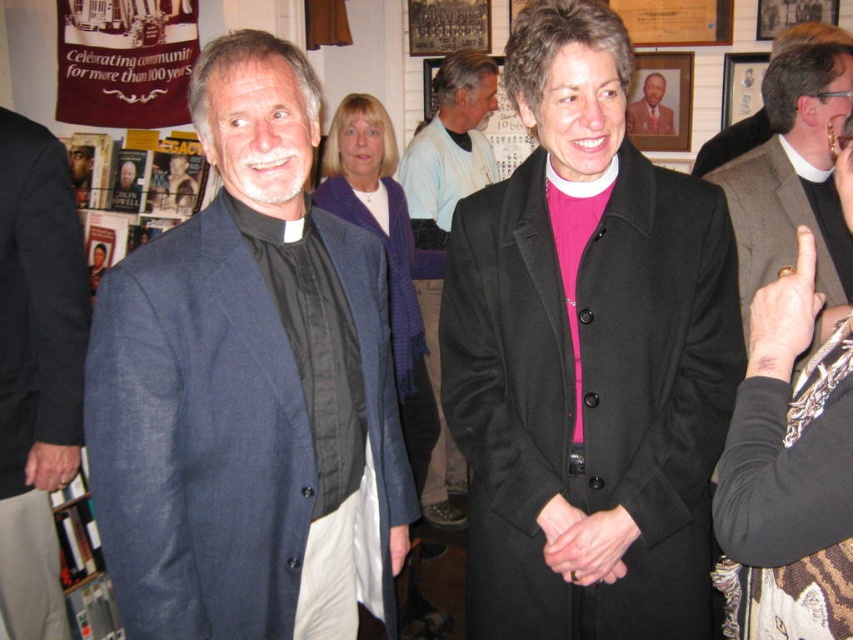
You are attending a community event and see the light blue fabric shirt at center and the gold ring at upper right. Which object is positioned higher in the image?

The light blue fabric shirt at center is located above the gold ring at upper right, so it is positioned higher in the image.

You are attending the centennial celebration and want to take a photo of the smooth black coat at center and the wooden portrait frame at upper center. Which object should you focus on first if you want to capture both in one shot?

The smooth black coat at center is located below the wooden portrait frame at upper center, so you should focus on the wooden portrait frame at upper center first to ensure both are in the frame.

You are organizing a photo shoot and need to place a 1.2 meter wide banner between the black matte coat at center and the matte black robe at upper right. Will there be enough space between them to fit the banner?

The distance between the black matte coat at center and the matte black robe at upper right is 1.12 meters. Since the banner is 1.2 meters wide, it will not fit between them as the space is slightly narrower than the banner.